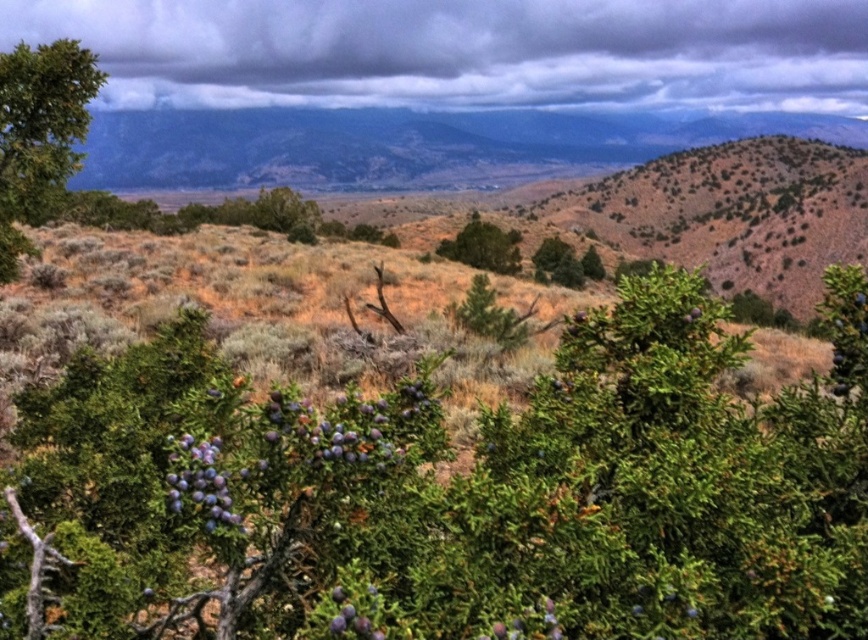
You are standing in the arid landscape and see a point marked at coordinates (847, 339). Based on the scene description, what might this point represent?

The point at (847, 339) indicates a blueberry like shrub at the right side of the image.